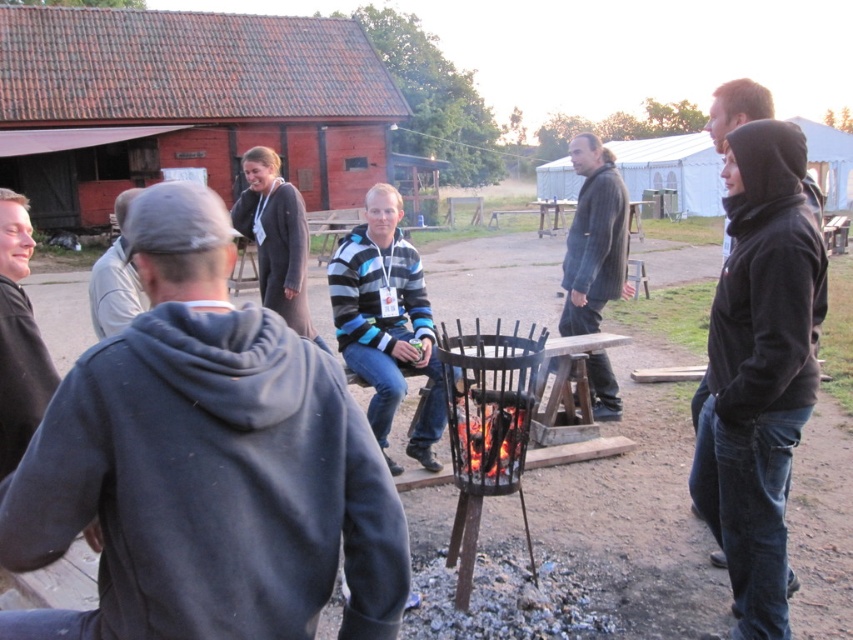
Is black fleece jacket at right positioned behind gray hoodie at center?

Yes, it is.

Which is below, black fleece jacket at right or gray hoodie at center?

Positioned lower is gray hoodie at center.

Between point (817, 195) and point (117, 250), which one is positioned in front?

Positioned in front is point (817, 195).

The height and width of the screenshot is (640, 853). Find the location of `black fleece jacket at right`. black fleece jacket at right is located at coordinates [735, 108].

Which is behind, point (392, 204) or point (573, 241)?

Point (573, 241)

Which is below, striped sweater at center or dark gray sweater at center?

striped sweater at center is lower down.

Measure the distance between striped sweater at center and camera.

They are 4.36 meters apart.

Locate an element on the screen. striped sweater at center is located at coordinates (386, 323).

Can you confirm if striped sweater at center is shorter than gray hoodie at center?

Yes.

Between striped sweater at center and gray hoodie at center, which one appears on the right side from the viewer's perspective?

From the viewer's perspective, striped sweater at center appears more on the right side.

Where is `striped sweater at center`? The image size is (853, 640). striped sweater at center is located at coordinates (386, 323).